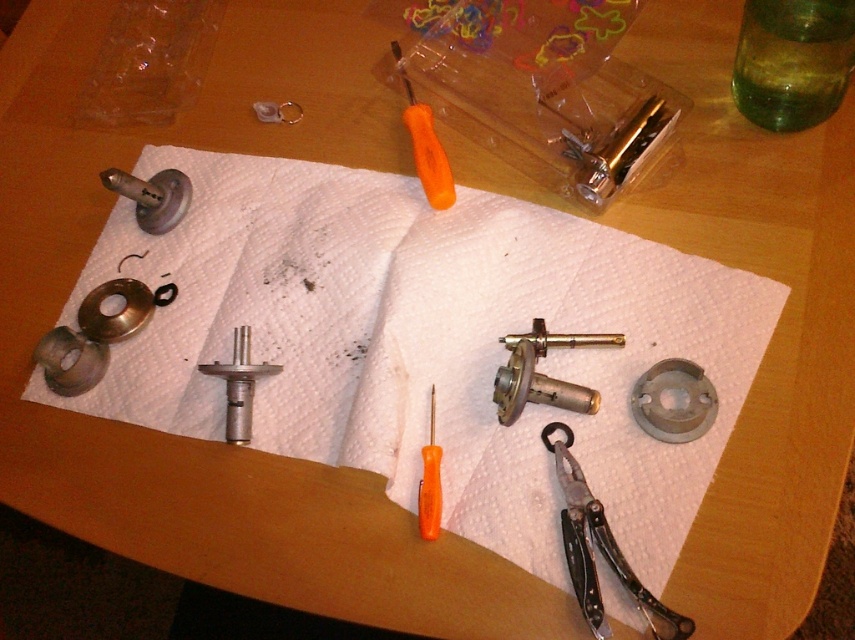
Question: Considering the real-world distances, which object is closest to the metallic silver cylinder at center?

Choices:
 (A) green glass bottle at upper right
 (B) orange plastic screwdriver at center
 (C) matte silver cylinder at upper left
 (D) black plastic scissors at lower right

Answer: (B)

Question: Which point is farther from the camera taking this photo?

Choices:
 (A) (563, 387)
 (B) (823, 76)
 (C) (127, 179)
 (D) (620, 563)

Answer: (C)

Question: Is green glass bottle at upper right to the right of matte silver cylinder at upper left from the viewer's perspective?

Choices:
 (A) no
 (B) yes

Answer: (B)

Question: Which of the following is the closest to the observer?

Choices:
 (A) (142, 189)
 (B) (600, 148)
 (C) (529, 378)

Answer: (C)

Question: In this image, where is green glass bottle at upper right located relative to matte silver cylinder at upper left?

Choices:
 (A) right
 (B) left

Answer: (A)

Question: Observing the image, what is the correct spatial positioning of metallic/brass/valve at center in reference to orange plastic screwdriver at center?

Choices:
 (A) left
 (B) right

Answer: (B)